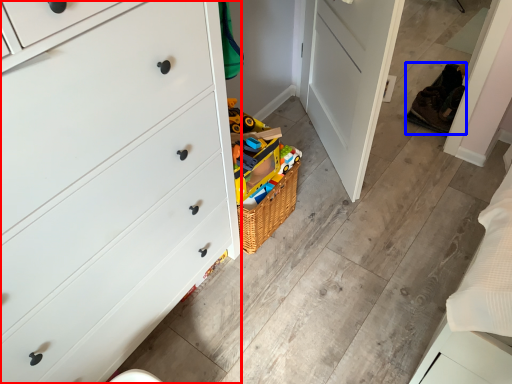
Question: Which object appears closest to the camera in this image, chest of drawers (highlighted by a red box) or shoe (highlighted by a blue box)?

Choices:
 (A) chest of drawers
 (B) shoe

Answer: (A)